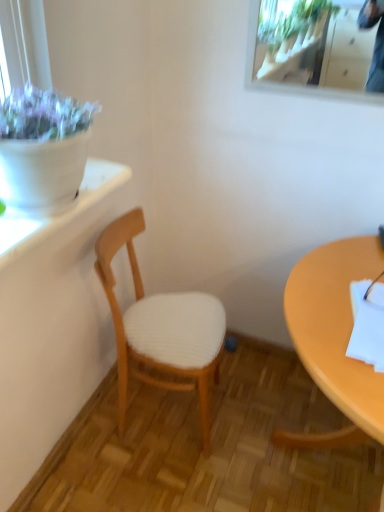
This screenshot has height=512, width=384. I want to click on vacant area that is in front of wooden chair at center, so click(150, 476).